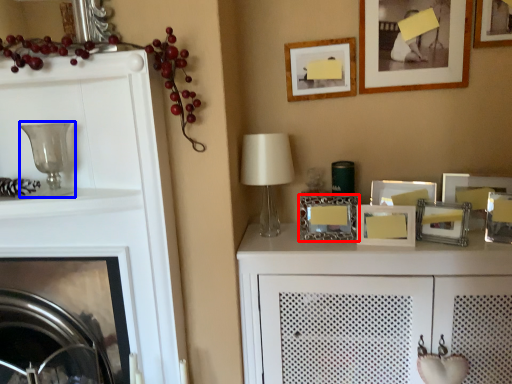
Question: Which object is closer to the camera taking this photo, picture frame (highlighted by a red box) or candle holder (highlighted by a blue box)?

Choices:
 (A) picture frame
 (B) candle holder

Answer: (B)